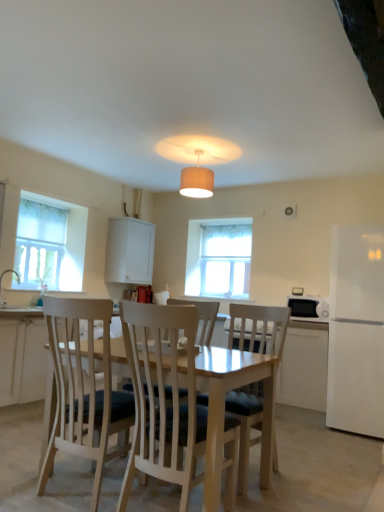
Identify the location of spots to the right of light wood chair at center, which is the first chair from right to left. (314, 490).